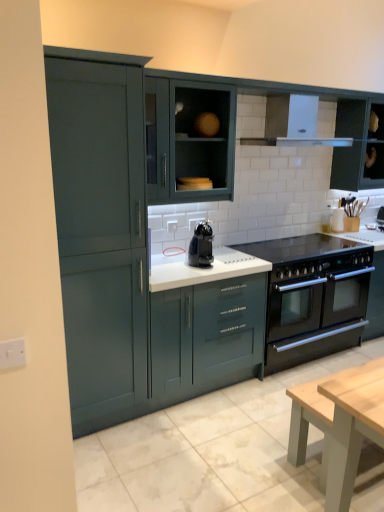
Question: Can you confirm if matte green cabinet at left, which is the 5th cabinetry in right-to-left order, is smaller than black glass gas stove at center?

Choices:
 (A) no
 (B) yes

Answer: (A)

Question: Is matte green cabinet at left, which is the first cabinetry from left to right, at the left side of black glass gas stove at center?

Choices:
 (A) yes
 (B) no

Answer: (A)

Question: Can you confirm if matte green cabinet at left, which is the 5th cabinetry in right-to-left order, is taller than black glass gas stove at center?

Choices:
 (A) yes
 (B) no

Answer: (A)

Question: Is matte green cabinet at left, which is the 5th cabinetry in right-to-left order, positioned in front of black glass gas stove at center?

Choices:
 (A) no
 (B) yes

Answer: (B)

Question: Is matte green cabinet at left, which is the 5th cabinetry in right-to-left order, directly adjacent to black glass gas stove at center?

Choices:
 (A) yes
 (B) no

Answer: (B)

Question: Considering the relative sizes of matte green cabinet at left, which is the first cabinetry from left to right, and black glass gas stove at center in the image provided, is matte green cabinet at left, which is the first cabinetry from left to right, shorter than black glass gas stove at center?

Choices:
 (A) no
 (B) yes

Answer: (A)

Question: Can you confirm if matte dark green cabinet at upper right, placed as the 5th cabinetry when sorted from left to right, is positioned to the left of black glossy coffee machine at center?

Choices:
 (A) yes
 (B) no

Answer: (B)

Question: Considering the relative sizes of matte dark green cabinet at upper right, the 1th cabinetry from the right, and black glossy coffee machine at center in the image provided, is matte dark green cabinet at upper right, the 1th cabinetry from the right, wider than black glossy coffee machine at center?

Choices:
 (A) yes
 (B) no

Answer: (A)

Question: Would you say matte dark green cabinet at upper right, placed as the 5th cabinetry when sorted from left to right, is outside black glossy coffee machine at center?

Choices:
 (A) yes
 (B) no

Answer: (A)

Question: Considering the relative sizes of matte dark green cabinet at upper right, placed as the 5th cabinetry when sorted from left to right, and black glossy coffee machine at center in the image provided, is matte dark green cabinet at upper right, placed as the 5th cabinetry when sorted from left to right, smaller than black glossy coffee machine at center?

Choices:
 (A) no
 (B) yes

Answer: (A)

Question: Is matte dark green cabinet at upper right, placed as the 5th cabinetry when sorted from left to right, at the right side of black glossy coffee machine at center?

Choices:
 (A) no
 (B) yes

Answer: (B)

Question: Can black glossy coffee machine at center be found inside matte dark green cabinet at upper right, placed as the 5th cabinetry when sorted from left to right?

Choices:
 (A) yes
 (B) no

Answer: (B)

Question: Is matte dark green cabinet at center, arranged as the 4th cabinetry when viewed from the left, not near white plastic switch at left, positioned as the 2th electric outlet in right-to-left order?

Choices:
 (A) no
 (B) yes

Answer: (B)